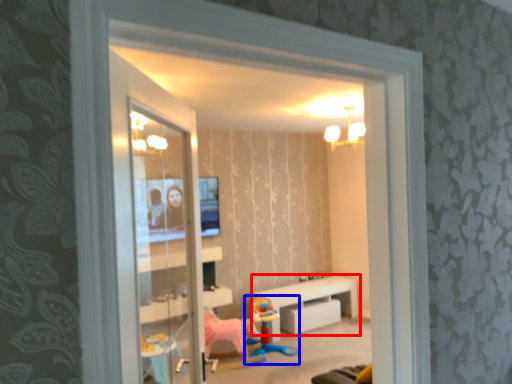
Question: Among these objects, which one is nearest to the camera, table (highlighted by a red box) or toy (highlighted by a blue box)?

Choices:
 (A) table
 (B) toy

Answer: (B)